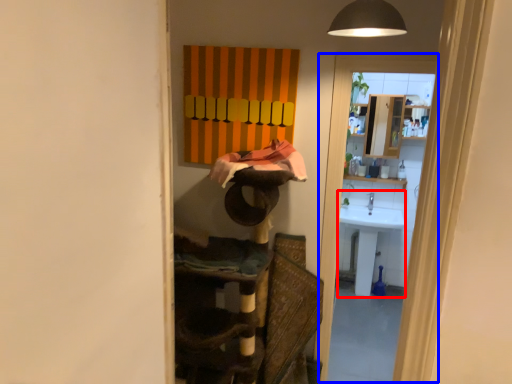
Question: Which object is further to the camera taking this photo, sink (highlighted by a red box) or screen door (highlighted by a blue box)?

Choices:
 (A) sink
 (B) screen door

Answer: (A)